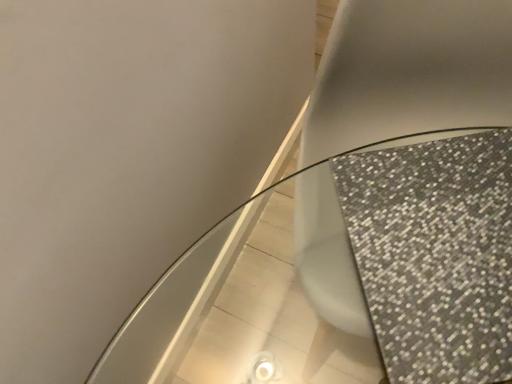
Question: Should I look upward or downward to see sparkly glass table at center?

Choices:
 (A) down
 (B) up

Answer: (A)

Question: Considering the relative sizes of sparkly glass table at center and matte gray toilet at center in the image provided, is sparkly glass table at center shorter than matte gray toilet at center?

Choices:
 (A) no
 (B) yes

Answer: (B)

Question: Is sparkly glass table at center completely or partially outside of matte gray toilet at center?

Choices:
 (A) no
 (B) yes

Answer: (A)

Question: Is sparkly glass table at center smaller than matte gray toilet at center?

Choices:
 (A) yes
 (B) no

Answer: (A)

Question: Is sparkly glass table at center further to camera compared to matte gray toilet at center?

Choices:
 (A) yes
 (B) no

Answer: (B)

Question: Is matte gray toilet at center inside sparkly glass table at center?

Choices:
 (A) yes
 (B) no

Answer: (A)

Question: Does sparkly glass table at center appear on the right side of matte gray toilet at center?

Choices:
 (A) no
 (B) yes

Answer: (A)

Question: Is matte gray toilet at center at the left side of sparkly glass table at center?

Choices:
 (A) yes
 (B) no

Answer: (B)

Question: From the image's perspective, is matte gray toilet at center under sparkly glass table at center?

Choices:
 (A) yes
 (B) no

Answer: (B)

Question: Considering the relative sizes of matte gray toilet at center and sparkly glass table at center in the image provided, is matte gray toilet at center bigger than sparkly glass table at center?

Choices:
 (A) yes
 (B) no

Answer: (A)

Question: Is matte gray toilet at center positioned before sparkly glass table at center?

Choices:
 (A) yes
 (B) no

Answer: (B)

Question: Is matte gray toilet at center next to sparkly glass table at center and touching it?

Choices:
 (A) no
 (B) yes

Answer: (A)

Question: Is matte gray toilet at center far from sparkly glass table at center?

Choices:
 (A) yes
 (B) no

Answer: (B)

Question: Considering the positions of point (179, 316) and point (463, 34), is point (179, 316) closer or farther from the camera than point (463, 34)?

Choices:
 (A) farther
 (B) closer

Answer: (A)